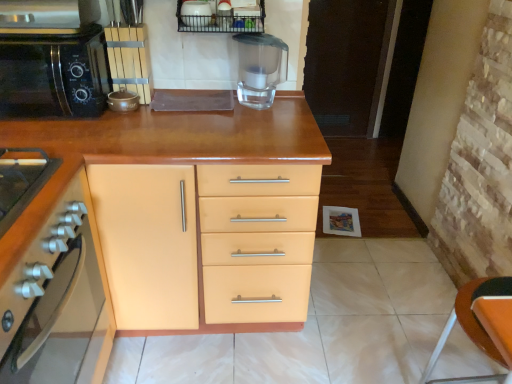
The width and height of the screenshot is (512, 384). Find the location of `free location in front of black matte microwave at left`. free location in front of black matte microwave at left is located at coordinates pos(39,138).